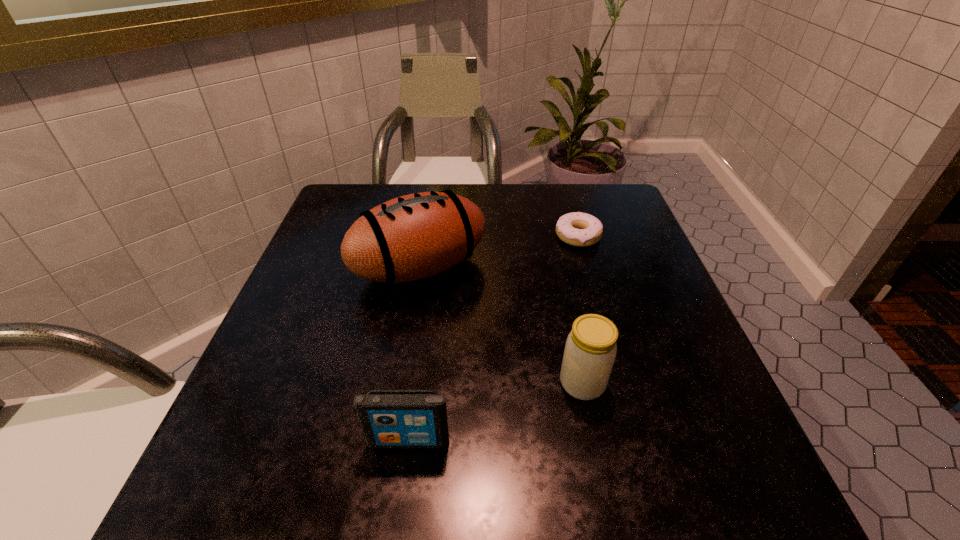
At what (x,y) coordinates should I click in order to perform the action: click on the tallest object. Please return your answer as a coordinate pair (x, y). This screenshot has width=960, height=540. Looking at the image, I should click on (416, 236).

The height and width of the screenshot is (540, 960). I want to click on jar, so click(590, 350).

The width and height of the screenshot is (960, 540). Identify the location of the third tallest object. (389, 418).

I want to click on the nearest object, so click(389, 418).

Locate an element on the screen. the shortest object is located at coordinates (579, 229).

I want to click on vacant position located on the front of the tallest object, so click(400, 389).

Find the location of a particular element. This screenshot has width=960, height=540. vacant position located 0.070m on the left of the third farthest object is located at coordinates (518, 383).

Locate an element on the screen. Image resolution: width=960 pixels, height=540 pixels. free space located on the front screen of the iPod is located at coordinates (401, 497).

In order to click on free space located 0.360m on the left of the shortest object in this screenshot , I will do `click(406, 236)`.

Where is `object located at the far edge`? object located at the far edge is located at coordinates (579, 229).